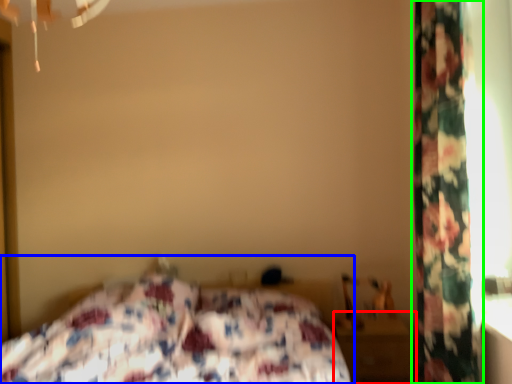
Question: Based on their relative distances, which object is nearer to nightstand (highlighted by a red box)? Choose from bed (highlighted by a blue box) and curtain (highlighted by a green box).

Choices:
 (A) bed
 (B) curtain

Answer: (A)